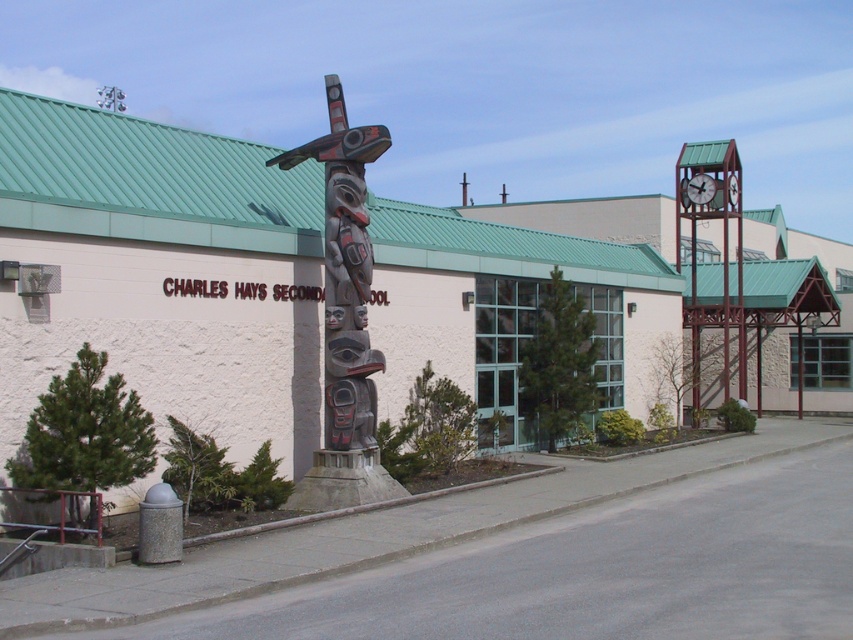
Question: Among these objects, which one is nearest to the camera?

Choices:
 (A) green metal clock tower at right
 (B) carved wooden totem pole at center

Answer: (B)

Question: Considering the relative positions of green metal clock tower at right and metallic clock at upper right in the image provided, where is green metal clock tower at right located with respect to metallic clock at upper right?

Choices:
 (A) left
 (B) right

Answer: (B)

Question: Does carved wooden totem pole at center have a lesser width compared to metallic clock at upper right?

Choices:
 (A) yes
 (B) no

Answer: (B)

Question: Which point is farther to the camera?

Choices:
 (A) green metal clock tower at right
 (B) metallic clock at upper right
 (C) carved wooden totem pole at center

Answer: (B)

Question: In this image, where is carved wooden totem pole at center located relative to metallic clock at upper right?

Choices:
 (A) above
 (B) below

Answer: (B)

Question: Which point is farther to the camera?

Choices:
 (A) (732, 321)
 (B) (697, 192)
 (C) (363, 275)

Answer: (A)